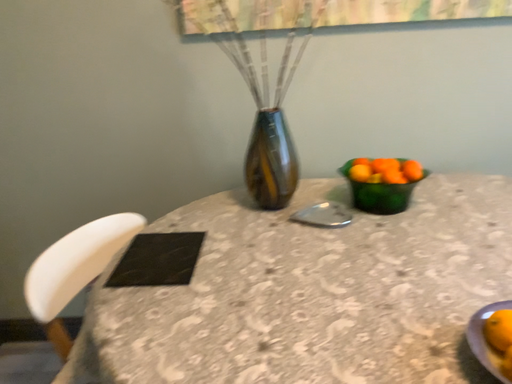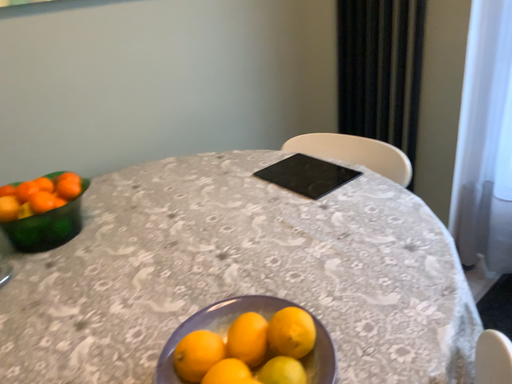
Question: Which way did the camera rotate in the video?

Choices:
 (A) rotated left
 (B) rotated right

Answer: (B)